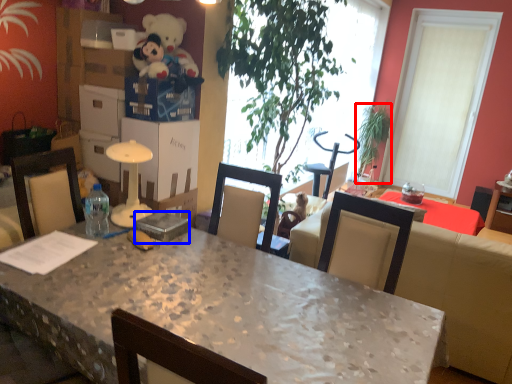
Question: Which object is closer to the camera taking this photo, houseplant (highlighted by a red box) or box (highlighted by a blue box)?

Choices:
 (A) houseplant
 (B) box

Answer: (B)